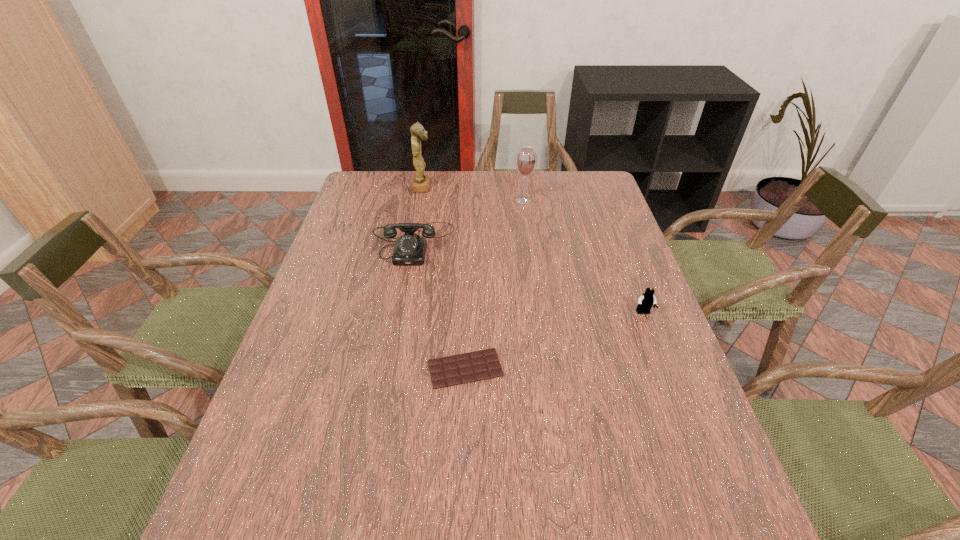
What are the coordinates of `vacant space situated 0.350m on the front of the fourth nearest object` in the screenshot? It's located at (534, 273).

Identify the location of vacant space located on the front-facing side of the third farthest object. (406, 288).

Identify the location of vacant space located 0.300m on the front-facing side of the Lego. (685, 424).

This screenshot has height=540, width=960. Identify the location of free space located 0.150m on the right of the shortest object. (568, 368).

I want to click on figurine that is at the far edge, so click(421, 182).

Identify the location of wineglass that is at the far edge. (526, 160).

This screenshot has height=540, width=960. What are the coordinates of `object located at the left edge` in the screenshot? It's located at (410, 249).

Identify the location of object located in the right edge section of the desktop. (645, 302).

In the image, there is a desktop. In order to click on free space at the far edge in this screenshot , I will do `click(481, 175)`.

The width and height of the screenshot is (960, 540). In the image, there is a desktop. Identify the location of vacant space at the near edge. (426, 538).